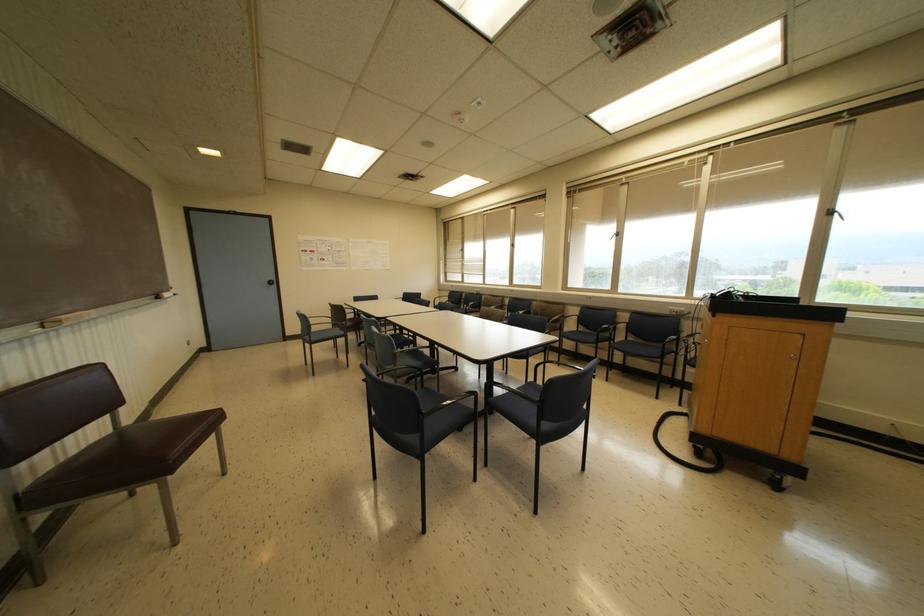
Describe the element at coordinates (271, 282) in the screenshot. The image size is (924, 616). I see `a black door knob` at that location.